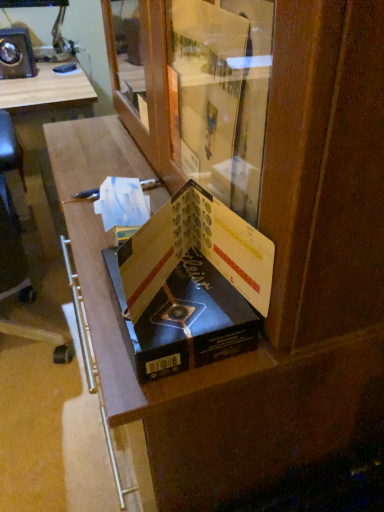
Question: Does matte black book at center, which is the first paperback book in back-to-front order, touch matte black book at center, which is the 1th paperback book from front to back?

Choices:
 (A) no
 (B) yes

Answer: (B)

Question: Is matte black book at center, which is the first paperback book in back-to-front order, bigger than matte black book at center, marked as the second paperback book in a back-to-front arrangement?

Choices:
 (A) no
 (B) yes

Answer: (A)

Question: Is matte black book at center, which is the first paperback book in back-to-front order, surrounding matte black book at center, which is the 1th paperback book from front to back?

Choices:
 (A) no
 (B) yes

Answer: (A)

Question: Is matte black book at center, the 2th paperback book from the front, thinner than matte black book at center, marked as the second paperback book in a back-to-front arrangement?

Choices:
 (A) no
 (B) yes

Answer: (A)

Question: Is matte black book at center, the 2th paperback book from the front, wider than matte black book at center, marked as the second paperback book in a back-to-front arrangement?

Choices:
 (A) yes
 (B) no

Answer: (A)

Question: Is matte black book at center, the 2th paperback book from the front, to the left of matte black book at center, which is the 1th paperback book from front to back, from the viewer's perspective?

Choices:
 (A) no
 (B) yes

Answer: (B)

Question: Is matte black book at center, marked as the second paperback book in a back-to-front arrangement, looking in the opposite direction of matte black book at center, which is the first paperback book in back-to-front order?

Choices:
 (A) no
 (B) yes

Answer: (A)

Question: Can you see matte black book at center, marked as the second paperback book in a back-to-front arrangement, touching matte black book at center, which is the first paperback book in back-to-front order?

Choices:
 (A) no
 (B) yes

Answer: (B)

Question: Is matte black book at center, which is the 1th paperback book from front to back, behind matte black book at center, which is the first paperback book in back-to-front order?

Choices:
 (A) no
 (B) yes

Answer: (A)

Question: From the image's perspective, is matte black book at center, which is the 1th paperback book from front to back, below matte black book at center, which is the first paperback book in back-to-front order?

Choices:
 (A) yes
 (B) no

Answer: (B)

Question: Does matte black book at center, marked as the second paperback book in a back-to-front arrangement, contain matte black book at center, which is the first paperback book in back-to-front order?

Choices:
 (A) yes
 (B) no

Answer: (B)

Question: Would you say matte black book at center, which is the 1th paperback book from front to back, is a long distance from matte black book at center, which is the first paperback book in back-to-front order?

Choices:
 (A) no
 (B) yes

Answer: (A)

Question: Looking at the image, does matte black book at center, which is the 1th paperback book from front to back, seem bigger or smaller compared to matte black book at center, which is the first paperback book in back-to-front order?

Choices:
 (A) small
 (B) big

Answer: (B)